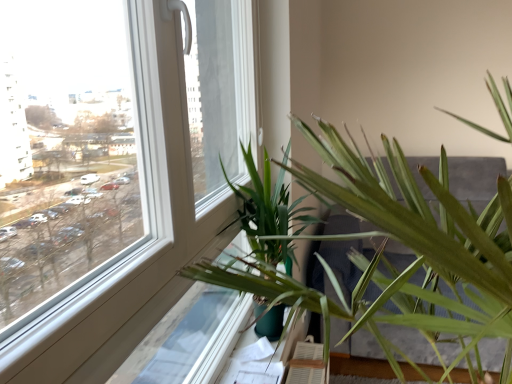
At what (x,y) coordinates should I click in order to perform the action: click on vacant space situated above green plastic at lower center (from a real-world perspective). Please return your answer as a coordinate pair (x, y). The image size is (512, 384). Looking at the image, I should click on (248, 349).